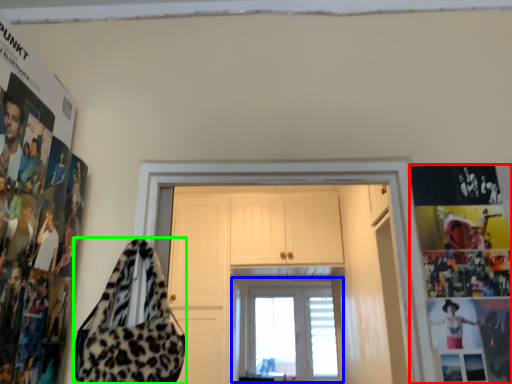
Question: Estimate the real-world distances between objects in this image. Which object is closer to poster page (highlighted by a red box), window (highlighted by a blue box) or shoulder bag (highlighted by a green box)?

Choices:
 (A) window
 (B) shoulder bag

Answer: (B)